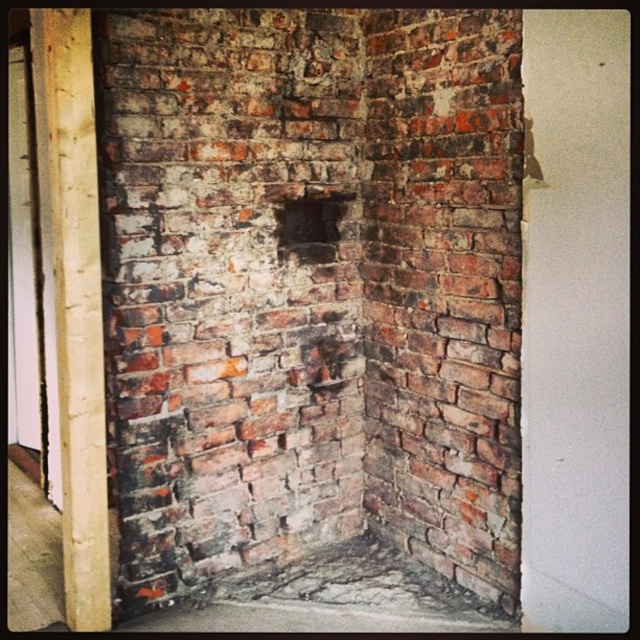
You are an interior designer assessing the wall in the room. You notice the weathered brick at center and the dark brick hole at center. Which of these two features is positioned to the left when viewed from the doorway?

The weathered brick at center is positioned to the left of the dark brick hole at center.

You are an interior designer assessing the wall in the room. You notice the weathered brick at center and the dark brick hole at center. Which of these two features is taller?

The weathered brick at center is much taller than the dark brick hole at center.